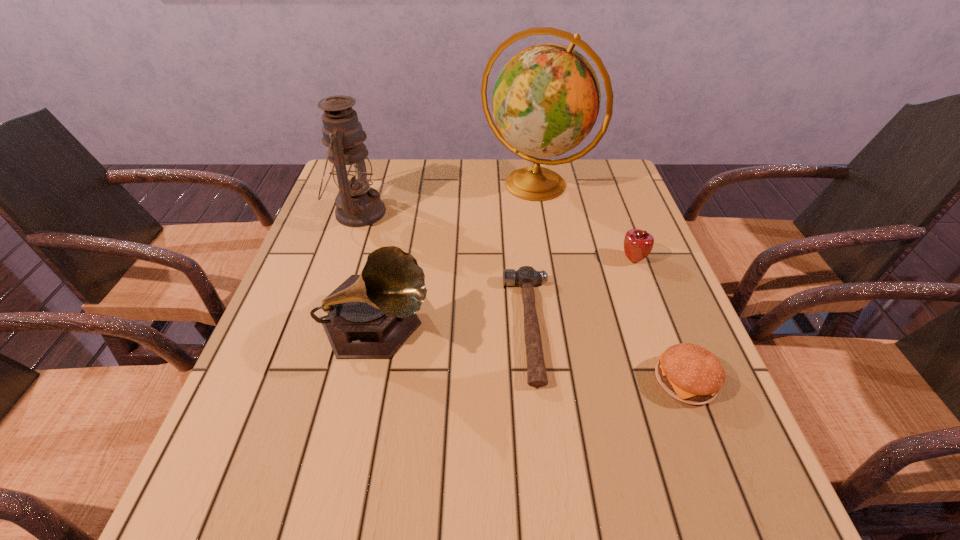
Locate an element on the screen. Image resolution: width=960 pixels, height=540 pixels. apple present at the right edge is located at coordinates (638, 244).

Locate an element on the screen. This screenshot has height=540, width=960. hamburger positioned at the right edge is located at coordinates (688, 372).

Where is `object located at the far left corner`? The image size is (960, 540). object located at the far left corner is located at coordinates (357, 205).

Identify the location of object at the far right corner. (546, 99).

Locate an element on the screen. free spot at the far edge of the desktop is located at coordinates (511, 171).

Where is `free spot at the near edge of the desktop`? The image size is (960, 540). free spot at the near edge of the desktop is located at coordinates (600, 492).

Where is `vacant space at the left edge`? vacant space at the left edge is located at coordinates (292, 404).

The image size is (960, 540). I want to click on vacant space at the right edge, so click(x=597, y=253).

You are a GUI agent. You are given a task and a screenshot of the screen. Output one action in this format:
    pyautogui.click(x=<x>, y=<y>)
    Task: Click on the vacant area at the far left corner
    This screenshot has width=960, height=540.
    Given the screenshot: What is the action you would take?
    pyautogui.click(x=384, y=159)

Image resolution: width=960 pixels, height=540 pixels. I want to click on vacant area at the near left corner, so click(258, 486).